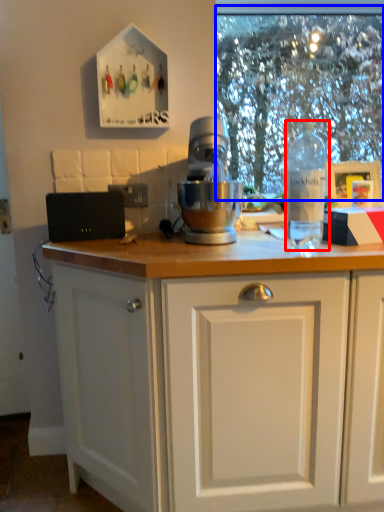
Question: Among these objects, which one is nearest to the camera, bottle (highlighted by a red box) or clear (highlighted by a blue box)?

Choices:
 (A) bottle
 (B) clear

Answer: (A)